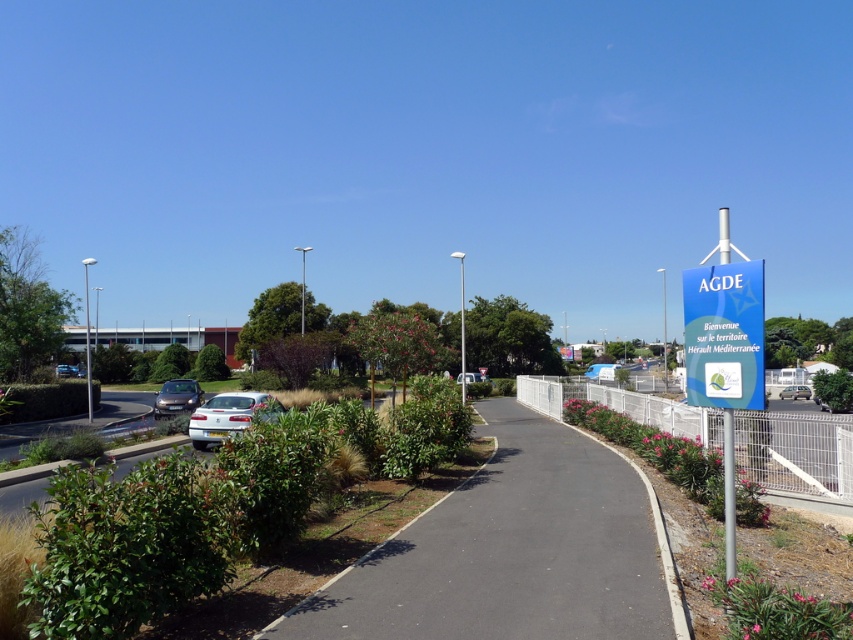
Question: Which point is farther to the camera?

Choices:
 (A) blue plastic sign at right
 (B) black asphalt path at center
 (C) silver metallic van at right

Answer: (C)

Question: Does silver metallic sedan at center appear over shiny silver car at lower left?

Choices:
 (A) yes
 (B) no

Answer: (A)

Question: Among these objects, which one is nearest to the camera?

Choices:
 (A) silver metallic sedan at center
 (B) blue plastic sign at right
 (C) black asphalt path at center
 (D) shiny silver car at lower left

Answer: (C)

Question: Is silver metallic sedan at center to the right of silver metallic van at right from the viewer's perspective?

Choices:
 (A) no
 (B) yes

Answer: (A)

Question: Among these objects, which one is nearest to the camera?

Choices:
 (A) silver metallic sedan at center
 (B) blue plastic sign at right
 (C) shiny silver car at lower left
 (D) silver metallic van at right

Answer: (B)

Question: Can you confirm if silver metallic sedan at center is positioned above shiny silver car at lower left?

Choices:
 (A) no
 (B) yes

Answer: (B)